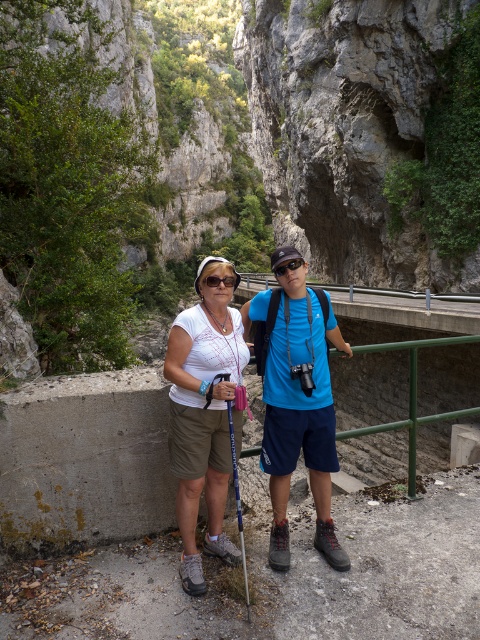
Based on the scene description, can you determine which object is closer to the viewer between the white fabric shirt at center and the black matte sunglasses at center?

The white fabric shirt at center is closer to the viewer than the black matte sunglasses at center.

You are a hiker trying to navigate through the narrow canyon. You see two points marked on your map at coordinates point (68, 596) and point (323, 385). Which point is closer to your current position if you are standing at the starting point of the pathway?

Point (68, 596) is in front of point (323, 385), so it is closer to your current position at the starting point of the pathway.